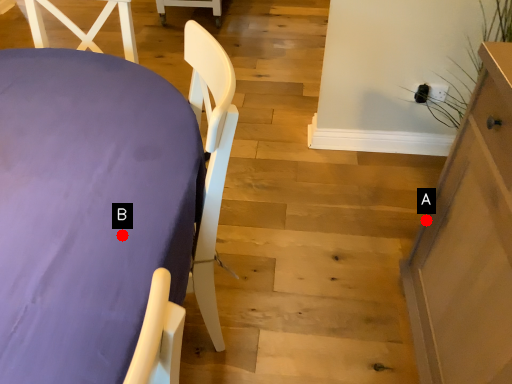
Question: Two points are circled on the image, labeled by A and B beside each circle. Which point is farther from the camera taking this photo?

Choices:
 (A) A is further
 (B) B is further

Answer: (A)